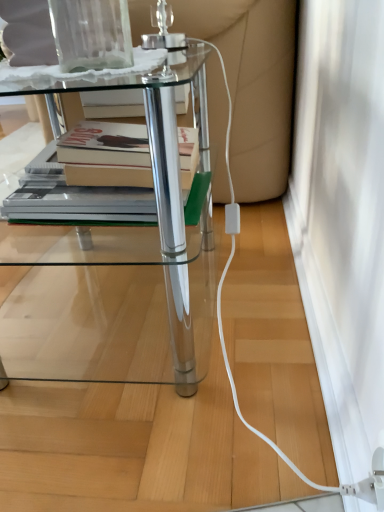
I want to click on vacant space underneath clear glass table at center (from a real-world perspective), so coord(132,309).